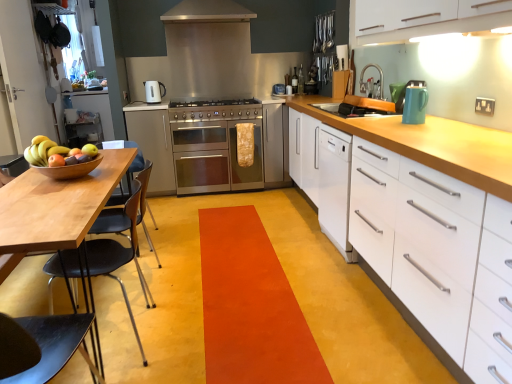
This screenshot has width=512, height=384. Find the location of `unoccupied space behind black plastic chair at left`. unoccupied space behind black plastic chair at left is located at coordinates (143, 287).